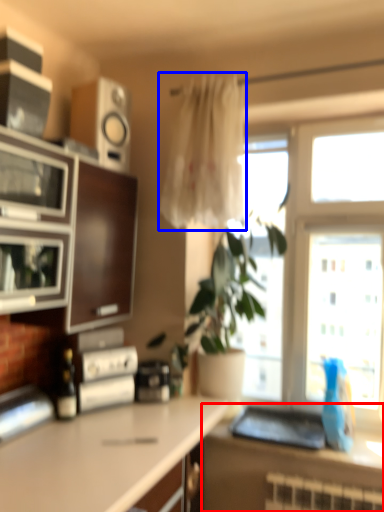
Question: Which point is further to the camera, countertop (highlighted by a red box) or curtain (highlighted by a blue box)?

Choices:
 (A) countertop
 (B) curtain

Answer: (B)